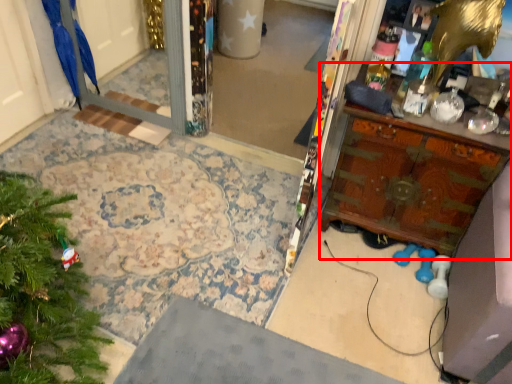
Question: From the image's perspective, where is vanity (annotated by the red box) located in relation to parrot in the image?

Choices:
 (A) above
 (B) below

Answer: (B)